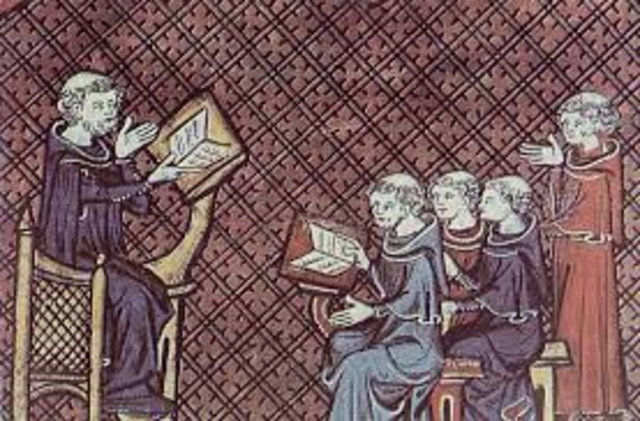
I want to click on chair, so click(x=170, y=268).